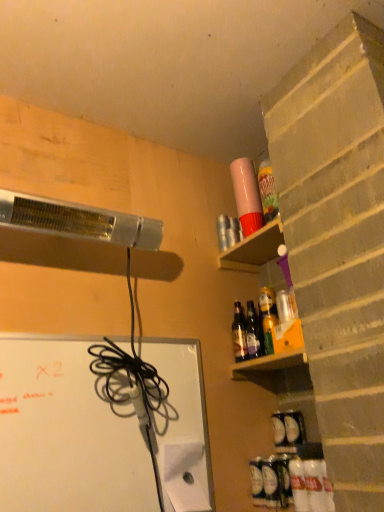
What do you see at coordinates (66, 434) in the screenshot? I see `white matte bulletin board at lower left` at bounding box center [66, 434].

This screenshot has width=384, height=512. What do you see at coordinates (254, 249) in the screenshot? I see `purple plastic cup at upper right` at bounding box center [254, 249].

You are a GUI agent. You are given a task and a screenshot of the screen. Output one action in this format:
    pyautogui.click(x=<x>, y=<y>)
    Task: Click on the shiny brown glass bottles at upper right, placed as the 1th bottle when sorted from back to front
    This screenshot has width=384, height=512.
    Given the screenshot: What is the action you would take?
    pyautogui.click(x=239, y=333)

From the picture: Can you tell me how much white matte bulletin board at lower left and purple plastic cup at upper right differ in facing direction?

There is a 89.9-degree angle between the facing directions of white matte bulletin board at lower left and purple plastic cup at upper right.

Considering the sizes of objects white matte bulletin board at lower left and purple plastic cup at upper right in the image provided, who is smaller, white matte bulletin board at lower left or purple plastic cup at upper right?

purple plastic cup at upper right.

Does white matte bulletin board at lower left appear on the left side of purple plastic cup at upper right?

Correct, you'll find white matte bulletin board at lower left to the left of purple plastic cup at upper right.

Considering the sizes of objects white matte bulletin board at lower left and purple plastic cup at upper right in the image provided, who is taller, white matte bulletin board at lower left or purple plastic cup at upper right?

Standing taller between the two is white matte bulletin board at lower left.

In the scene shown: Between white matte bulletin board at lower left and translucent plastic bottle at lower right, the third bottle when ordered from top to bottom, which one has less height?

With less height is translucent plastic bottle at lower right, the third bottle when ordered from top to bottom.

Considering the positions of point (14, 340) and point (301, 501), is point (14, 340) closer or farther from the camera than point (301, 501)?

Point (14, 340).

Is white matte bulletin board at lower left next to translucent plastic bottle at lower right, the 3th bottle in the back-to-front sequence, and touching it?

No, white matte bulletin board at lower left is not with translucent plastic bottle at lower right, the 3th bottle in the back-to-front sequence.

What's the angular difference between translucent glass bottles at shelf right, marked as the third bottle in a bottom-to-top arrangement, and translucent plastic bottle at lower right, placed as the 1th bottle when sorted from bottom to top,'s facing directions?

3.1 degrees.

Can you confirm if translucent glass bottles at shelf right, the second bottle positioned from the front, is smaller than translucent plastic bottle at lower right, placed as the 1th bottle when sorted from bottom to top?

No, translucent glass bottles at shelf right, the second bottle positioned from the front, is not smaller than translucent plastic bottle at lower right, placed as the 1th bottle when sorted from bottom to top.

Is translucent plastic bottle at lower right, which ranks as the first bottle in front-to-back order, at the back of translucent glass bottles at shelf right, marked as the third bottle in a bottom-to-top arrangement?

translucent glass bottles at shelf right, marked as the third bottle in a bottom-to-top arrangement, does not have its back to translucent plastic bottle at lower right, which ranks as the first bottle in front-to-back order.

I want to click on the 1st bottle to the left of the translucent plastic bottle at lower right, the third bottle when ordered from top to bottom, starting your count from the anchor, so coord(253,332).

Is purple plastic cup at upper right at the right side of shiny brown glass bottles at upper right, acting as the third bottle starting from the front?

Yes, purple plastic cup at upper right is to the right of shiny brown glass bottles at upper right, acting as the third bottle starting from the front.

Is purple plastic cup at upper right spatially inside shiny brown glass bottles at upper right, placed as the 1th bottle when sorted from back to front, or outside of it?

purple plastic cup at upper right exists outside the volume of shiny brown glass bottles at upper right, placed as the 1th bottle when sorted from back to front.

Between purple plastic cup at upper right and shiny brown glass bottles at upper right, acting as the third bottle starting from the front, which one has larger width?

purple plastic cup at upper right is wider.

Considering the sizes of purple plastic cup at upper right and shiny brown glass bottles at upper right, placed as the 1th bottle when sorted from back to front, in the image, is purple plastic cup at upper right taller or shorter than shiny brown glass bottles at upper right, placed as the 1th bottle when sorted from back to front,?

Considering their sizes, purple plastic cup at upper right has less height than shiny brown glass bottles at upper right, placed as the 1th bottle when sorted from back to front.

From a real-world perspective, between translucent glass bottles at shelf right, arranged as the 1th bottle when viewed from the top, and shiny brown glass bottles at upper right, acting as the third bottle starting from the front, who is vertically lower?

translucent glass bottles at shelf right, arranged as the 1th bottle when viewed from the top.

Which object is wider, translucent glass bottles at shelf right, marked as the third bottle in a bottom-to-top arrangement, or shiny brown glass bottles at upper right, placed as the 1th bottle when sorted from back to front?

Wider between the two is shiny brown glass bottles at upper right, placed as the 1th bottle when sorted from back to front.

Is translucent glass bottles at shelf right, arranged as the 1th bottle when viewed from the top, oriented away from shiny brown glass bottles at upper right, placed as the 1th bottle when sorted from back to front?

translucent glass bottles at shelf right, arranged as the 1th bottle when viewed from the top, is not turned away from shiny brown glass bottles at upper right, placed as the 1th bottle when sorted from back to front.

Is point (241, 356) closer or farther from the camera than point (304, 486)?

Point (241, 356) appears to be farther away from the viewer than point (304, 486).

From the image's perspective, is shiny brown glass bottles at upper right, the second bottle ordered from the bottom, beneath translucent plastic bottle at lower right, placed as the 1th bottle when sorted from bottom to top?

Actually, shiny brown glass bottles at upper right, the second bottle ordered from the bottom, appears above translucent plastic bottle at lower right, placed as the 1th bottle when sorted from bottom to top, in the image.

Could translucent plastic bottle at lower right, the third bottle when ordered from top to bottom, be considered to be inside shiny brown glass bottles at upper right, placed as the 1th bottle when sorted from back to front?

That's incorrect, translucent plastic bottle at lower right, the third bottle when ordered from top to bottom, is not inside shiny brown glass bottles at upper right, placed as the 1th bottle when sorted from back to front.

Can you confirm if shiny brown glass bottles at upper right, placed as the 1th bottle when sorted from back to front, is wider than translucent plastic bottle at lower right, which ranks as the first bottle in front-to-back order?

Correct, the width of shiny brown glass bottles at upper right, placed as the 1th bottle when sorted from back to front, exceeds that of translucent plastic bottle at lower right, which ranks as the first bottle in front-to-back order.

From a real-world perspective, does translucent plastic bottle at lower right, placed as the 1th bottle when sorted from bottom to top, stand above white matte bulletin board at lower left?

No, from a real-world perspective, translucent plastic bottle at lower right, placed as the 1th bottle when sorted from bottom to top, is not over white matte bulletin board at lower left

From the image's perspective, relative to white matte bulletin board at lower left, is translucent plastic bottle at lower right, which ranks as the first bottle in front-to-back order, above or below?

Based on their image positions, translucent plastic bottle at lower right, which ranks as the first bottle in front-to-back order, is located beneath white matte bulletin board at lower left.

Who is bigger, translucent plastic bottle at lower right, the third bottle when ordered from top to bottom, or white matte bulletin board at lower left?

white matte bulletin board at lower left.

Consider the image. In terms of width, does translucent plastic bottle at lower right, the third bottle when ordered from top to bottom, look wider or thinner when compared to white matte bulletin board at lower left?

Considering their sizes, translucent plastic bottle at lower right, the third bottle when ordered from top to bottom, looks broader than white matte bulletin board at lower left.

Find the location of a particular element. shelf located on the right of white matte bulletin board at lower left is located at coordinates click(x=254, y=249).

Locate an element on the screen. Image resolution: width=384 pixels, height=512 pixels. bottle that is the 1st one when counting backward from the white matte bulletin board at lower left is located at coordinates (298, 485).

Looking at the image, which one is located closer to translucent glass bottles at shelf right, which is the 2th bottle from back to front, white matte bulletin board at lower left or translucent plastic bottle at lower right, which ranks as the first bottle in front-to-back order?

translucent plastic bottle at lower right, which ranks as the first bottle in front-to-back order, is closer to translucent glass bottles at shelf right, which is the 2th bottle from back to front.

Looking at the image, which one is located further to white matte bulletin board at lower left, translucent plastic bottle at lower right, which ranks as the first bottle in front-to-back order, or translucent glass bottles at shelf right, marked as the third bottle in a bottom-to-top arrangement?

translucent plastic bottle at lower right, which ranks as the first bottle in front-to-back order, lies further to white matte bulletin board at lower left than the other object.

Based on their spatial positions, is translucent glass bottles at shelf right, the second bottle positioned from the front, or white matte bulletin board at lower left closer to translucent plastic bottle at lower right, which ranks as the first bottle in front-to-back order?

Among the two, translucent glass bottles at shelf right, the second bottle positioned from the front, is located nearer to translucent plastic bottle at lower right, which ranks as the first bottle in front-to-back order.

When comparing their distances from purple plastic cup at upper right, does translucent plastic bottle at lower right, placed as the 1th bottle when sorted from bottom to top, or white matte bulletin board at lower left seem closer?

white matte bulletin board at lower left lies closer to purple plastic cup at upper right than the other object.

Considering their positions, is white matte bulletin board at lower left positioned closer to purple plastic cup at upper right than translucent glass bottles at shelf right, the second bottle positioned from the front?

translucent glass bottles at shelf right, the second bottle positioned from the front, is positioned closer to the anchor purple plastic cup at upper right.

Looking at the image, which one is located further to purple plastic cup at upper right, translucent glass bottles at shelf right, the second bottle positioned from the front, or translucent plastic bottle at lower right, the third bottle when ordered from top to bottom?

translucent plastic bottle at lower right, the third bottle when ordered from top to bottom, is positioned further to the anchor purple plastic cup at upper right.

When comparing their distances from white matte bulletin board at lower left, does translucent glass bottles at shelf right, marked as the third bottle in a bottom-to-top arrangement, or shiny brown glass bottles at upper right, positioned as the second bottle in top-to-bottom order, seem closer?

The object closer to white matte bulletin board at lower left is shiny brown glass bottles at upper right, positioned as the second bottle in top-to-bottom order.

Estimate the real-world distances between objects in this image. Which object is closer to translucent glass bottles at shelf right, marked as the third bottle in a bottom-to-top arrangement, purple plastic cup at upper right or translucent plastic bottle at lower right, the 3th bottle in the back-to-front sequence?

purple plastic cup at upper right lies closer to translucent glass bottles at shelf right, marked as the third bottle in a bottom-to-top arrangement, than the other object.

Locate an element on the screen. Image resolution: width=384 pixels, height=512 pixels. bulletin board between purple plastic cup at upper right and translucent plastic bottle at lower right, the third bottle when ordered from top to bottom, from top to bottom is located at coordinates (66, 434).

At what (x,y) coordinates should I click in order to perform the action: click on bottle between translucent glass bottles at shelf right, the second bottle positioned from the front, and translucent plastic bottle at lower right, the 3th bottle in the back-to-front sequence, in the vertical direction. Please return your answer as a coordinate pair (x, y). The height and width of the screenshot is (512, 384). Looking at the image, I should click on (239, 333).

Locate an element on the screen. This screenshot has width=384, height=512. bottle between purple plastic cup at upper right and shiny brown glass bottles at upper right, the second bottle ordered from the bottom, in the up-down direction is located at coordinates (253, 332).

You are a GUI agent. You are given a task and a screenshot of the screen. Output one action in this format:
    pyautogui.click(x=<x>, y=<y>)
    Task: Click on the shelf between white matte bulletin board at lower left and shiny brown glass bottles at upper right, the second bottle ordered from the bottom, along the z-axis
    This screenshot has height=512, width=384.
    Given the screenshot: What is the action you would take?
    pyautogui.click(x=254, y=249)